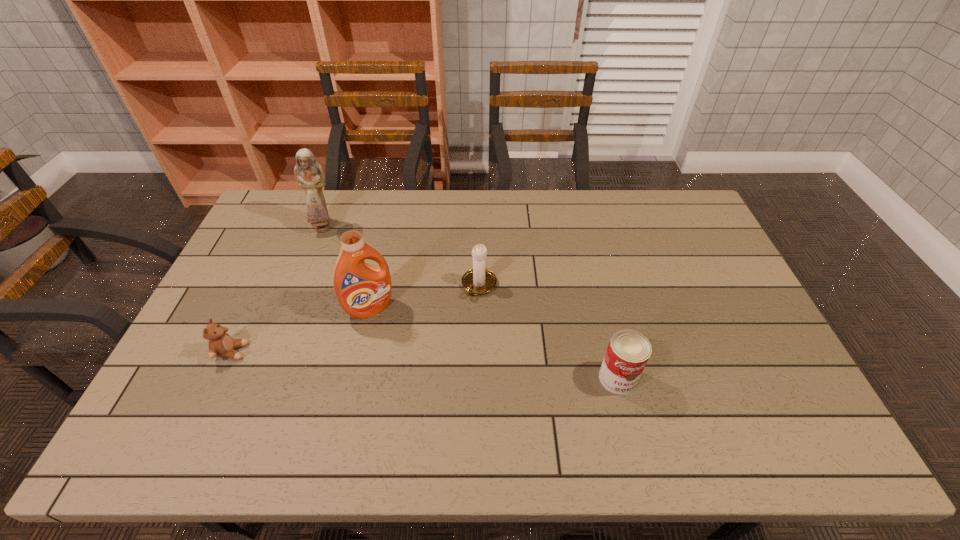
Find the location of `vacant space on the desktop that is between the shortest object and the second shortest object and is positioned on the front-facing side of the third object from right to left`. vacant space on the desktop that is between the shortest object and the second shortest object and is positioned on the front-facing side of the third object from right to left is located at coordinates (403, 363).

Where is `vacant spot on the desktop that is between the teddy bear and the fourth tallest object and is positioned on the front-facing side of the farthest object`? The width and height of the screenshot is (960, 540). vacant spot on the desktop that is between the teddy bear and the fourth tallest object and is positioned on the front-facing side of the farthest object is located at coordinates (454, 367).

Where is `free spot on the desktop that is between the shortest object and the can and is positioned on the handle side of the fourth object from left to right`? The height and width of the screenshot is (540, 960). free spot on the desktop that is between the shortest object and the can and is positioned on the handle side of the fourth object from left to right is located at coordinates (422, 364).